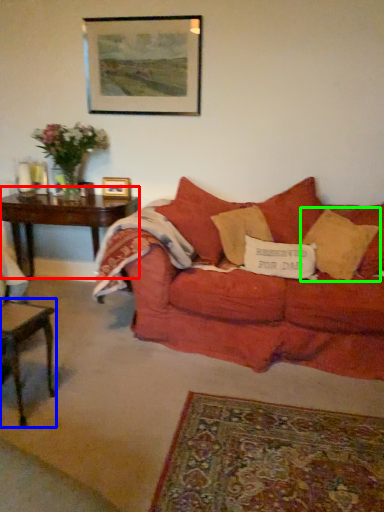
Question: Considering the real-world distances, which object is farthest from table (highlighted by a red box)? table (highlighted by a blue box) or pillow (highlighted by a green box)?

Choices:
 (A) table
 (B) pillow

Answer: (B)